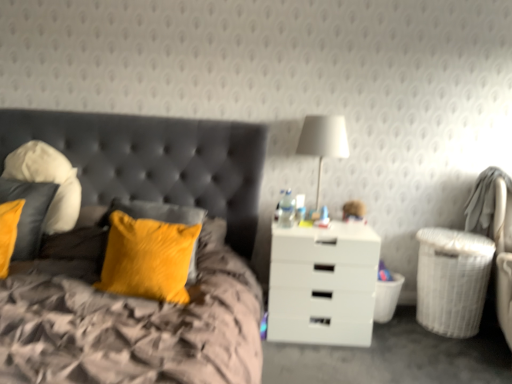
At what (x,y) coordinates should I click in order to perform the action: click on soft white pillow at left, the 1th pillow positioned from the left. Please return your answer as a coordinate pair (x, y). The image size is (512, 384). Looking at the image, I should click on (48, 181).

Find the location of a particular element. The width and height of the screenshot is (512, 384). white matte lampshade at upper right is located at coordinates (323, 140).

Locate an element on the screen. velvet yellow pillow at left, marked as the 2th pillow in a left-to-right arrangement is located at coordinates (28, 213).

Image resolution: width=512 pixels, height=384 pixels. What do you see at coordinates (495, 234) in the screenshot? I see `white woven swivel chair at right` at bounding box center [495, 234].

The image size is (512, 384). Describe the element at coordinates (452, 280) in the screenshot. I see `white wicker laundry basket at lower right, positioned as the 2th laundry basket in left-to-right order` at that location.

Identify the location of soft white pillow at left, which is counted as the third pillow, starting from the right. The height and width of the screenshot is (384, 512). (48, 181).

Considering the sizes of objects white wicker laundry basket at right, placed as the first laundry basket when sorted from left to right, and white glossy nightstand at center in the image provided, who is thinner, white wicker laundry basket at right, placed as the first laundry basket when sorted from left to right, or white glossy nightstand at center?

white wicker laundry basket at right, placed as the first laundry basket when sorted from left to right, is thinner.

What are the coordinates of `nightstand that is above the white wicker laundry basket at right, placed as the first laundry basket when sorted from left to right (from a real-world perspective)` in the screenshot? It's located at (323, 284).

From the image's perspective, is white wicker laundry basket at right, placed as the 2th laundry basket when sorted from right to left, under white glossy nightstand at center?

Yes, from the image's perspective, white wicker laundry basket at right, placed as the 2th laundry basket when sorted from right to left, is below white glossy nightstand at center.

Considering the positions of objects white wicker laundry basket at right, placed as the first laundry basket when sorted from left to right, and white glossy nightstand at center in the image provided, who is more to the left, white wicker laundry basket at right, placed as the first laundry basket when sorted from left to right, or white glossy nightstand at center?

From the viewer's perspective, white glossy nightstand at center appears more on the left side.

Is soft white pillow at left, which is counted as the third pillow, starting from the right, closer to the viewer compared to white wicker laundry basket at right, placed as the 2th laundry basket when sorted from right to left?

Yes.

Is soft white pillow at left, the 1th pillow positioned from the left, not inside white wicker laundry basket at right, placed as the 2th laundry basket when sorted from right to left?

That's correct, soft white pillow at left, the 1th pillow positioned from the left, is outside of white wicker laundry basket at right, placed as the 2th laundry basket when sorted from right to left.

Can you confirm if soft white pillow at left, the 1th pillow positioned from the left, is wider than white wicker laundry basket at right, placed as the 2th laundry basket when sorted from right to left?

Incorrect, the width of soft white pillow at left, the 1th pillow positioned from the left, does not surpass that of white wicker laundry basket at right, placed as the 2th laundry basket when sorted from right to left.

Which is more to the left, soft white pillow at left, which is counted as the third pillow, starting from the right, or white wicker laundry basket at right, placed as the 2th laundry basket when sorted from right to left?

soft white pillow at left, which is counted as the third pillow, starting from the right, is more to the left.

Is the position of white matte lampshade at upper right more distant than that of velvet yellow pillow at left, which is the 2th pillow from right to left?

Yes, it is.

Considering the sizes of objects white matte lampshade at upper right and velvet yellow pillow at left, which is the 2th pillow from right to left, in the image provided, who is wider, white matte lampshade at upper right or velvet yellow pillow at left, which is the 2th pillow from right to left,?

white matte lampshade at upper right is wider.

Can you confirm if white matte lampshade at upper right is bigger than velvet yellow pillow at left, which is the 2th pillow from right to left?

Yes.

From a real-world perspective, is white matte lampshade at upper right located higher than velvet yellow pillow at left, marked as the 2th pillow in a left-to-right arrangement?

Indeed, from a real-world perspective, white matte lampshade at upper right stands above velvet yellow pillow at left, marked as the 2th pillow in a left-to-right arrangement.

Is the depth of white wicker laundry basket at right, placed as the 2th laundry basket when sorted from right to left, greater than that of velvet yellow pillow at upper left?

Yes, it is.

Considering the relative sizes of white wicker laundry basket at right, placed as the first laundry basket when sorted from left to right, and velvet yellow pillow at upper left in the image provided, is white wicker laundry basket at right, placed as the first laundry basket when sorted from left to right, thinner than velvet yellow pillow at upper left?

Yes, white wicker laundry basket at right, placed as the first laundry basket when sorted from left to right, is thinner than velvet yellow pillow at upper left.

Measure the distance between white wicker laundry basket at right, placed as the first laundry basket when sorted from left to right, and velvet yellow pillow at upper left.

They are 4.54 feet apart.

Is white wicker laundry basket at right, placed as the first laundry basket when sorted from left to right, at the left side of velvet yellow pillow at upper left?

Incorrect, white wicker laundry basket at right, placed as the first laundry basket when sorted from left to right, is not on the left side of velvet yellow pillow at upper left.

Measure the distance between white wicker laundry basket at right, placed as the first laundry basket when sorted from left to right, and white woven swivel chair at right.

white wicker laundry basket at right, placed as the first laundry basket when sorted from left to right, and white woven swivel chair at right are 68.57 centimeters apart.

Does white wicker laundry basket at right, placed as the 2th laundry basket when sorted from right to left, lie in front of white woven swivel chair at right?

That is False.

Would you say white wicker laundry basket at right, placed as the first laundry basket when sorted from left to right, is to the left or to the right of white woven swivel chair at right in the picture?

white wicker laundry basket at right, placed as the first laundry basket when sorted from left to right, is positioned on white woven swivel chair at right's left side.

How different are the orientations of soft white pillow at left, which is counted as the third pillow, starting from the right, and velvet yellow pillow at left, which is the 2th pillow from right to left, in degrees?

They differ by 0.000538 degrees in their facing directions.

Looking at this image, considering the relative sizes of soft white pillow at left, which is counted as the third pillow, starting from the right, and velvet yellow pillow at left, marked as the 2th pillow in a left-to-right arrangement, in the image provided, is soft white pillow at left, which is counted as the third pillow, starting from the right, shorter than velvet yellow pillow at left, marked as the 2th pillow in a left-to-right arrangement,?

No.

Looking at this image, are soft white pillow at left, the 1th pillow positioned from the left, and velvet yellow pillow at left, marked as the 2th pillow in a left-to-right arrangement, far apart?

No, soft white pillow at left, the 1th pillow positioned from the left, is not far from velvet yellow pillow at left, marked as the 2th pillow in a left-to-right arrangement.

Locate an element on the screen. The height and width of the screenshot is (384, 512). pillow that is the 1st object located below the soft white pillow at left, the 1th pillow positioned from the left (from the image's perspective) is located at coordinates (28, 213).

Which is less distant, (125, 221) or (287, 279)?

Point (125, 221) is positioned closer to the camera compared to point (287, 279).

Which is in front, velvet yellow pillow at center-left, the 1th pillow positioned from the right, or white glossy nightstand at center?

Positioned in front is velvet yellow pillow at center-left, the 1th pillow positioned from the right.

Consider the image. Does velvet yellow pillow at center-left, which is counted as the 3th pillow, starting from the left, contain white glossy nightstand at center?

No, velvet yellow pillow at center-left, which is counted as the 3th pillow, starting from the left, does not contain white glossy nightstand at center.

Considering the sizes of objects velvet yellow pillow at center-left, which is counted as the 3th pillow, starting from the left, and white glossy nightstand at center in the image provided, who is smaller, velvet yellow pillow at center-left, which is counted as the 3th pillow, starting from the left, or white glossy nightstand at center?

Smaller between the two is velvet yellow pillow at center-left, which is counted as the 3th pillow, starting from the left.

Find the location of `the 1st laundry basket to the right of the white glossy nightstand at center, starting your count from the anchor`. the 1st laundry basket to the right of the white glossy nightstand at center, starting your count from the anchor is located at coordinates (387, 298).

At what (x,y) coordinates should I click in order to perform the action: click on the 3rd pillow above when counting from the white wicker laundry basket at right, placed as the 2th laundry basket when sorted from right to left (from the image's perspective). Please return your answer as a coordinate pair (x, y). This screenshot has width=512, height=384. Looking at the image, I should click on (48, 181).

Estimate the real-world distances between objects in this image. Which object is closer to velvet yellow pillow at center-left, which is counted as the 3th pillow, starting from the left, white glossy nightstand at center or white wicker laundry basket at lower right, the 1th laundry basket positioned from the right?

white glossy nightstand at center.

Considering their positions, is white wicker laundry basket at lower right, positioned as the 2th laundry basket in left-to-right order, positioned further to white woven swivel chair at right than soft white pillow at left, which is counted as the third pillow, starting from the right?

soft white pillow at left, which is counted as the third pillow, starting from the right, is further to white woven swivel chair at right.

When comparing their distances from velvet yellow pillow at left, marked as the 2th pillow in a left-to-right arrangement, does velvet yellow pillow at upper left or velvet yellow pillow at center-left, the 1th pillow positioned from the right, seem closer?

The object closer to velvet yellow pillow at left, marked as the 2th pillow in a left-to-right arrangement, is velvet yellow pillow at upper left.

From the image, which object appears to be nearer to white wicker laundry basket at right, placed as the first laundry basket when sorted from left to right, white glossy nightstand at center or velvet yellow pillow at center-left, which is counted as the 3th pillow, starting from the left?

white glossy nightstand at center is closer to white wicker laundry basket at right, placed as the first laundry basket when sorted from left to right.

Which object lies nearer to the anchor point white wicker laundry basket at lower right, positioned as the 2th laundry basket in left-to-right order, soft white pillow at left, the 1th pillow positioned from the left, or velvet yellow pillow at center-left, the 1th pillow positioned from the right?

Based on the image, velvet yellow pillow at center-left, the 1th pillow positioned from the right, appears to be nearer to white wicker laundry basket at lower right, positioned as the 2th laundry basket in left-to-right order.

Looking at the image, which one is located further to white glossy nightstand at center, white matte lampshade at upper right or white wicker laundry basket at lower right, positioned as the 2th laundry basket in left-to-right order?

white matte lampshade at upper right is further to white glossy nightstand at center.

Considering their positions, is velvet yellow pillow at upper left positioned further to white wicker laundry basket at right, placed as the first laundry basket when sorted from left to right, than soft white pillow at left, which is counted as the third pillow, starting from the right?

soft white pillow at left, which is counted as the third pillow, starting from the right, lies further to white wicker laundry basket at right, placed as the first laundry basket when sorted from left to right, than the other object.

Estimate the real-world distances between objects in this image. Which object is closer to velvet yellow pillow at center-left, which is counted as the 3th pillow, starting from the left, white wicker laundry basket at lower right, positioned as the 2th laundry basket in left-to-right order, or white wicker laundry basket at right, placed as the 2th laundry basket when sorted from right to left?

The object closer to velvet yellow pillow at center-left, which is counted as the 3th pillow, starting from the left, is white wicker laundry basket at right, placed as the 2th laundry basket when sorted from right to left.

At what (x,y) coordinates should I click in order to perform the action: click on bedside lamp located between soft white pillow at left, the 1th pillow positioned from the left, and white woven swivel chair at right in the left-right direction. Please return your answer as a coordinate pair (x, y). The width and height of the screenshot is (512, 384). Looking at the image, I should click on (323, 140).

Locate an element on the screen. The width and height of the screenshot is (512, 384). nightstand between velvet yellow pillow at center-left, the 1th pillow positioned from the right, and white woven swivel chair at right from left to right is located at coordinates (323, 284).

What are the coordinates of `laundry basket situated between white glossy nightstand at center and white wicker laundry basket at lower right, positioned as the 2th laundry basket in left-to-right order, from left to right` in the screenshot? It's located at (387, 298).

Find the location of a particular element. Image resolution: width=512 pixels, height=384 pixels. bed between velvet yellow pillow at left, marked as the 2th pillow in a left-to-right arrangement, and white wicker laundry basket at lower right, positioned as the 2th laundry basket in left-to-right order, in the horizontal direction is located at coordinates (103, 249).